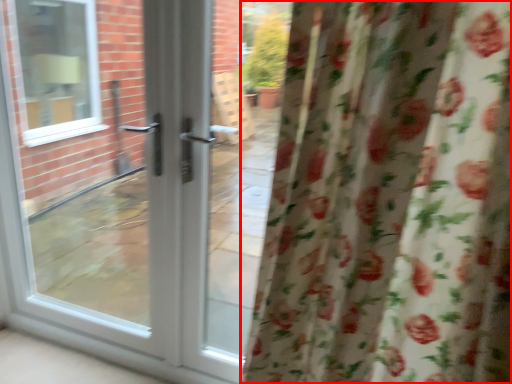
Question: In this image, where is curtain (annotated by the red box) located relative to door?

Choices:
 (A) right
 (B) left

Answer: (A)